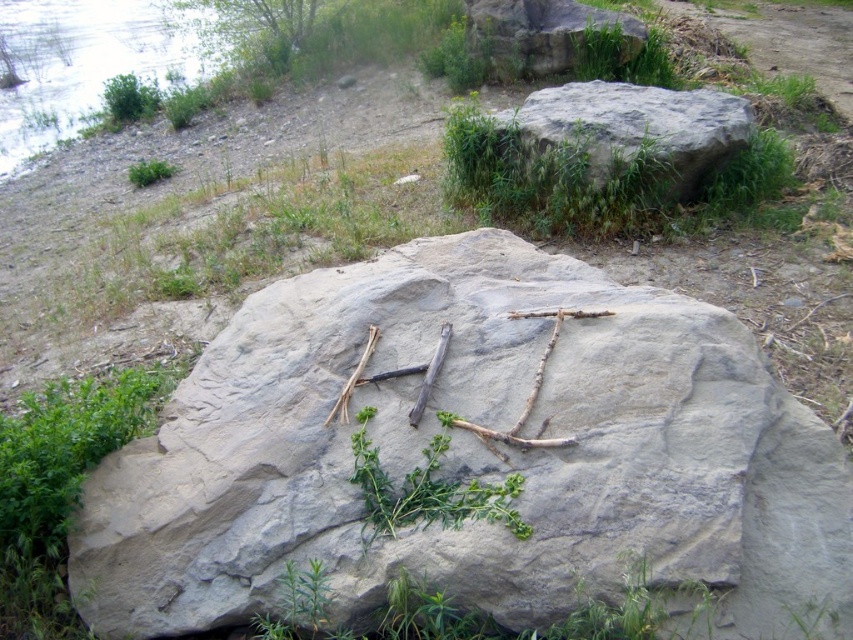
Question: Can you confirm if gray rock at center is bigger than green leafy tree at upper left?

Choices:
 (A) yes
 (B) no

Answer: (B)

Question: Among these objects, which one is farthest from the camera?

Choices:
 (A) green leafy tree at upper left
 (B) gray rough rock at upper center
 (C) gray rock at upper center

Answer: (A)

Question: Does gray rock at upper center appear on the right side of green leafy tree at upper left?

Choices:
 (A) yes
 (B) no

Answer: (A)

Question: Can you confirm if gray rock at center is positioned to the right of green leafy tree at upper left?

Choices:
 (A) no
 (B) yes

Answer: (B)

Question: Which point appears farthest from the camera in this image?

Choices:
 (A) (578, 12)
 (B) (361, 428)
 (C) (277, 8)
 (D) (381, 273)

Answer: (C)

Question: Which of the following is the farthest from the observer?

Choices:
 (A) (387, 484)
 (B) (729, 150)
 (C) (572, 4)
 (D) (296, 44)

Answer: (D)